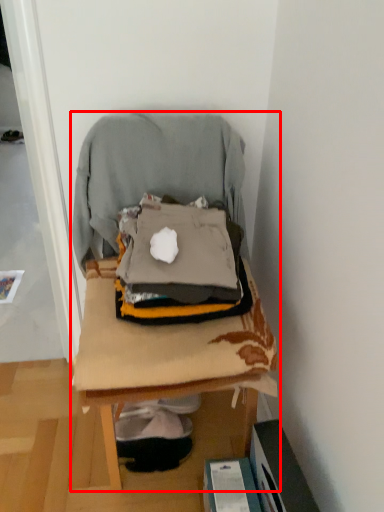
Question: Considering the relative positions of furniture (annotated by the red box) and bean bag chair in the image provided, where is furniture (annotated by the red box) located with respect to the staircase?

Choices:
 (A) left
 (B) right

Answer: (B)